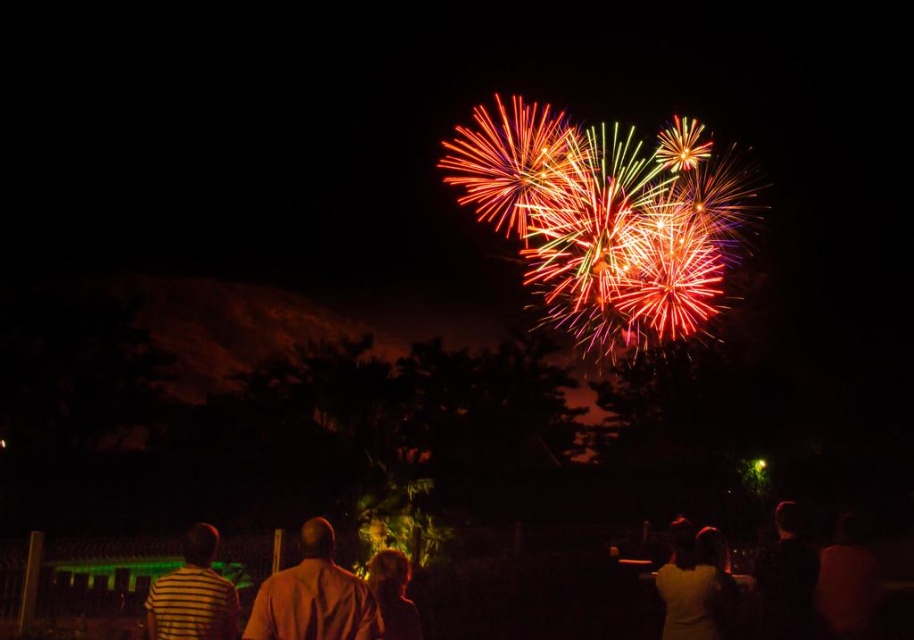
Question: Which object is positioned closest to the blonde hair at center?

Choices:
 (A) brown matte shirt at center
 (B) dark brown hair at lower right

Answer: (A)

Question: Is striped cotton shirt at lower left smaller than blonde hair at center?

Choices:
 (A) yes
 (B) no

Answer: (B)

Question: Which object is positioned farthest from the multicolored sparkler at upper center?

Choices:
 (A) dark brown hair at lower right
 (B) brown matte shirt at center

Answer: (B)

Question: Is dark brown hair at lower right further to the viewer compared to blonde hair at center?

Choices:
 (A) yes
 (B) no

Answer: (A)

Question: Which object is the closest to the dark skin textured shirt at lower right?

Choices:
 (A) dark brown hair at lower right
 (B) yellow matte shirt at lower right
 (C) brown matte shirt at center
 (D) multicolored sparkler at upper center

Answer: (A)

Question: Where is dark brown hair at lower right located in relation to yellow matte shirt at lower right in the image?

Choices:
 (A) left
 (B) right

Answer: (B)